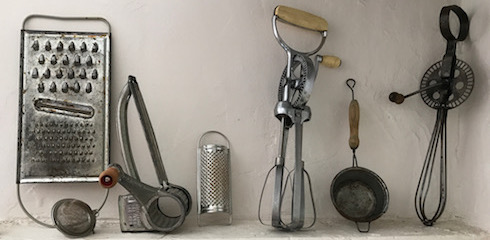
Locate an element on the screen. The width and height of the screenshot is (490, 240). well loved kitchen gadget is located at coordinates (71, 127), (154, 191), (214, 160), (282, 107), (354, 167), (443, 80).